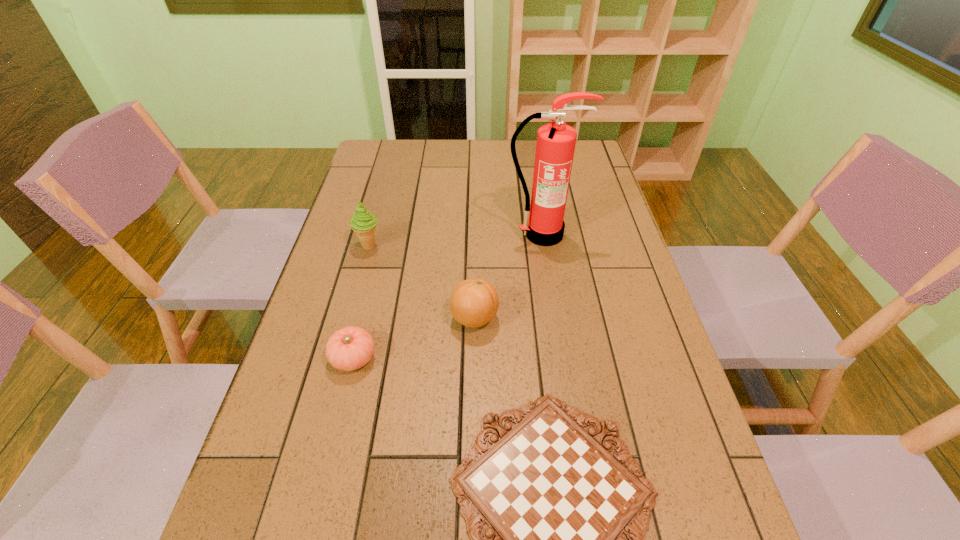
Locate an element on the screen. free spot between the orange and the icecream is located at coordinates (421, 282).

The image size is (960, 540). I want to click on free spot between the third shortest object and the fire extinguisher, so click(x=508, y=276).

The height and width of the screenshot is (540, 960). Find the location of `empty location between the icecream and the fire extinguisher`. empty location between the icecream and the fire extinguisher is located at coordinates pos(455,240).

Image resolution: width=960 pixels, height=540 pixels. In order to click on object that stands as the closest to the fire extinguisher in this screenshot , I will do `click(474, 302)`.

Locate which object is the third closest to the nearest object. Please provide its 2D coordinates. Your answer should be formatted as a tuple, i.e. [(x, y)], where the tuple contains the x and y coordinates of a point satisfying the conditions above.

[(543, 225)]